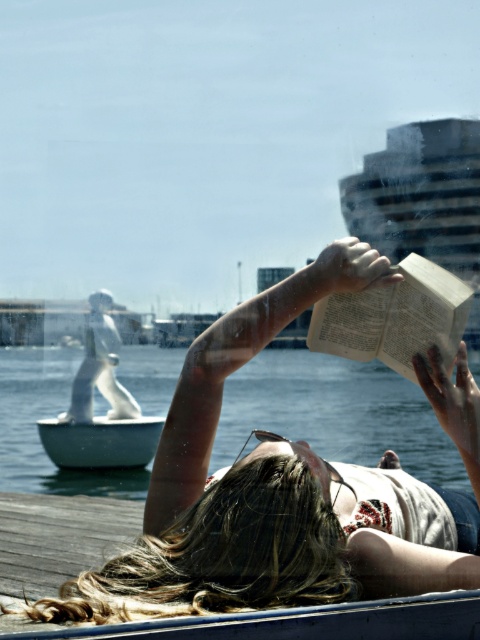
You are a photographer trying to capture the scene of the person reading. You notice the smooth white hair at upper center and the white paper book at upper right. Which object should you focus on first if you want to ensure both are in focus, considering their positions relative to each other?

The smooth white hair at upper center is below the white paper book at upper right, so you should focus on the white paper book at upper right first to ensure both are in focus since it is farther away.

You are a photographer trying to capture the scene with a camera. You notice the smooth white hair at upper center and the white matte boat at lower left. Which object would require a wider lens aperture to focus on due to its smaller size?

The smooth white hair at upper center has a lesser width compared to the white matte boat at lower left, so it would require a wider lens aperture to focus on due to its smaller size.

You are a photographer trying to capture the scene from the perspective of the person reading. Which object, the smooth white hair at upper center or the white matte boat at lower left, would appear closer to your camera lens?

The smooth white hair at upper center appears closer to the camera lens because it is positioned to the right of the white matte boat at lower left, indicating it is in a more forward plane in the visual field.